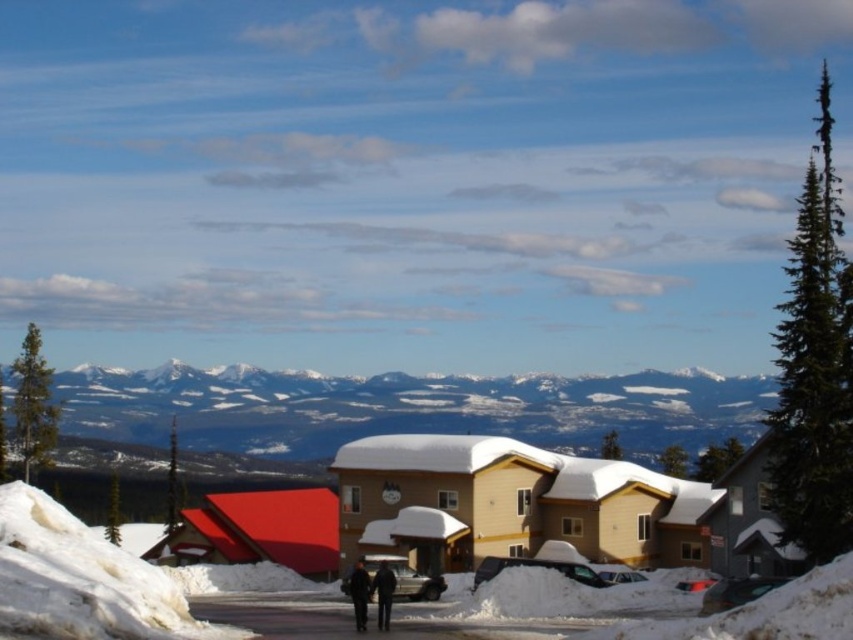
Does smooth snow ski slope at lower left have a greater width compared to black fabric jacket at center?

Correct, the width of smooth snow ski slope at lower left exceeds that of black fabric jacket at center.

Who is more distant from viewer, (91,636) or (355,579)?

Point (355,579)

Locate an element on the screen. The image size is (853, 640). smooth snow ski slope at lower left is located at coordinates (83, 579).

Does snow-covered mountain at upper center have a greater width compared to beige wood ski resort at center?

Indeed, snow-covered mountain at upper center has a greater width compared to beige wood ski resort at center.

Does snow-covered mountain at upper center appear under beige wood ski resort at center?

Indeed, snow-covered mountain at upper center is positioned under beige wood ski resort at center.

Who is more distant from viewer, (117,378) or (672,531)?

The point (117,378) is behind.

Identify the location of snow-covered mountain at upper center. The height and width of the screenshot is (640, 853). (407, 408).

Is snow-covered mountain at upper center positioned behind black fabric jacket at center?

Yes, it is.

Between snow-covered mountain at upper center and black fabric jacket at center, which one is positioned lower?

snow-covered mountain at upper center is below.

Is point (704, 410) farther from camera compared to point (357, 568)?

Yes, point (704, 410) is farther from viewer.

Identify the location of snow-covered mountain at upper center. Image resolution: width=853 pixels, height=640 pixels. (407, 408).